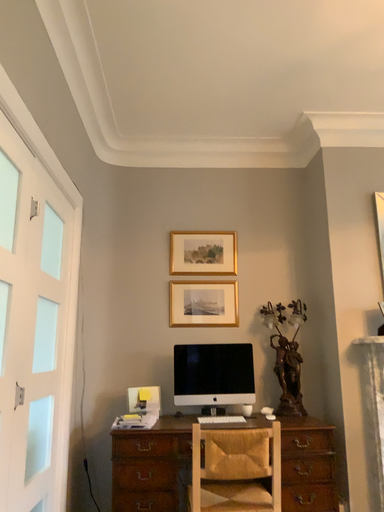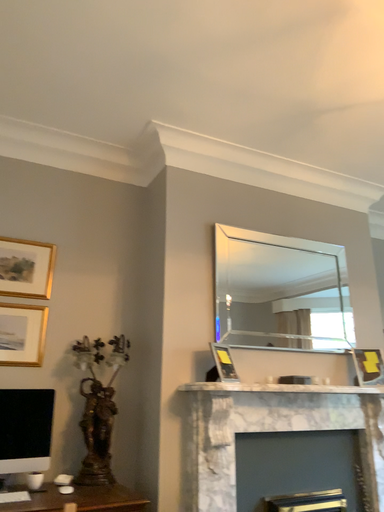
Question: How did the camera likely rotate when shooting the video?

Choices:
 (A) rotated left
 (B) rotated right

Answer: (B)